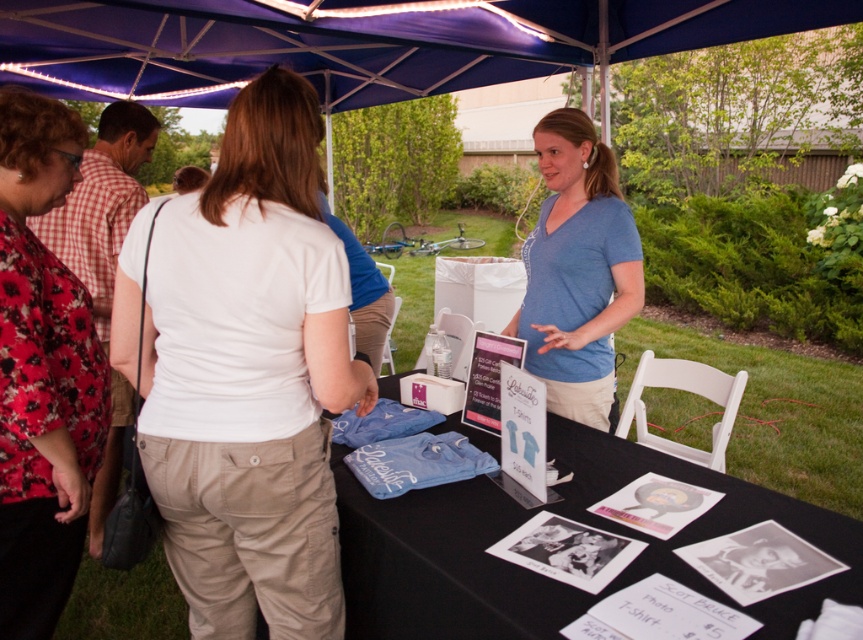
Question: Does white cotton shirt at center lie behind floral print blouse at upper left?

Choices:
 (A) no
 (B) yes

Answer: (A)

Question: Estimate the real-world distances between objects in this image. Which object is farther from the white cotton shirt at center?

Choices:
 (A) floral print blouse at upper left
 (B) blue fabric canopy at upper center
 (C) blue fabric table at center

Answer: (B)

Question: Does blue fabric canopy at upper center appear on the left side of blue cotton shirt at center?

Choices:
 (A) yes
 (B) no

Answer: (A)

Question: Which of the following is the farthest from the observer?

Choices:
 (A) blue fabric canopy at upper center
 (B) blue cotton shirt at center
 (C) floral print blouse at upper left
 (D) blue fabric table at center

Answer: (A)

Question: Considering the real-world distances, which object is closest to the blue fabric table at center?

Choices:
 (A) white cotton shirt at center
 (B) floral print blouse at upper left

Answer: (A)

Question: From the image, what is the correct spatial relationship of floral print blouse at upper left in relation to blue cotton shirt at center?

Choices:
 (A) above
 (B) below

Answer: (B)